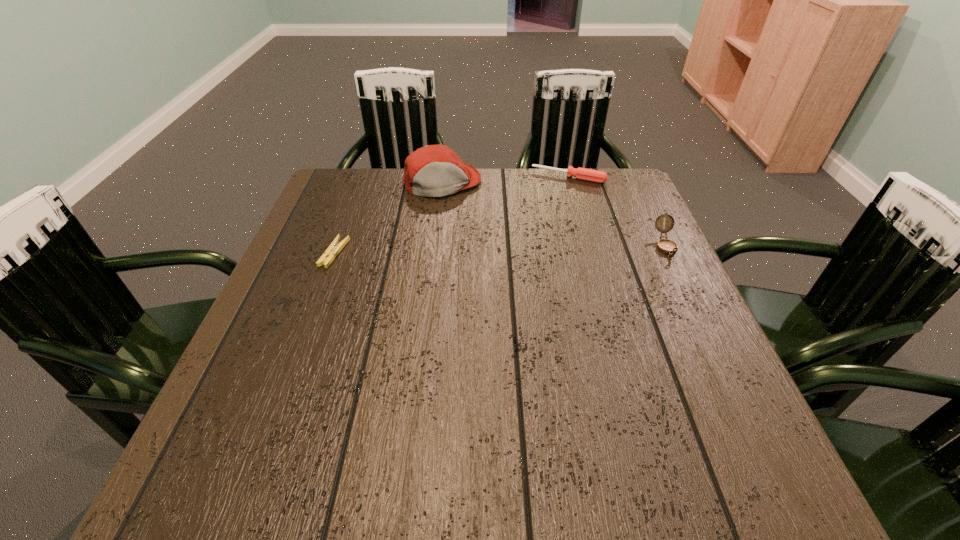
The height and width of the screenshot is (540, 960). In order to click on vacant space on the desktop that is between the shortest object and the rightmost object and is positioned on the front-facing side of the tallest object in this screenshot , I will do `click(470, 251)`.

The height and width of the screenshot is (540, 960). I want to click on free space on the desktop that is between the clothespin and the compass and is positioned at the blade of the screwdriver, so click(538, 249).